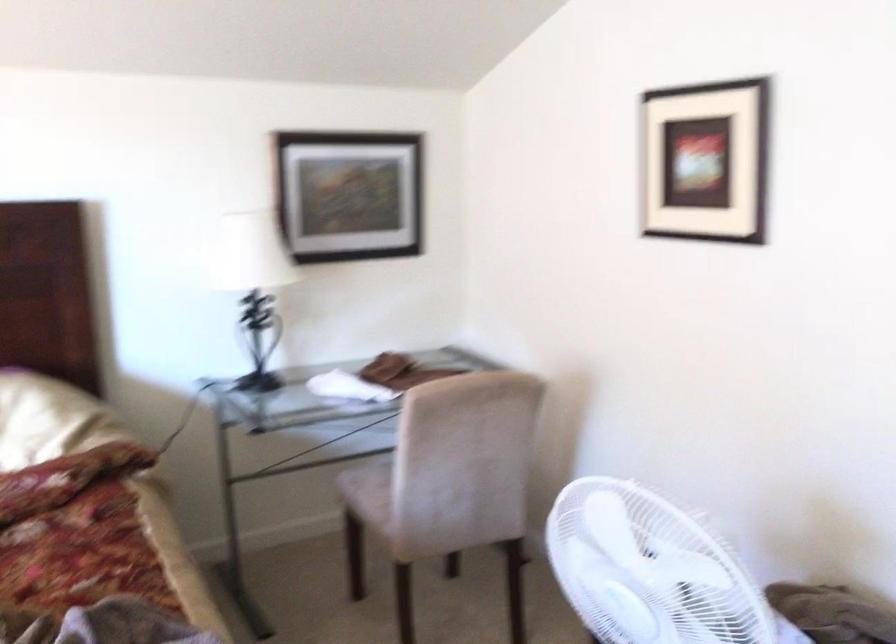
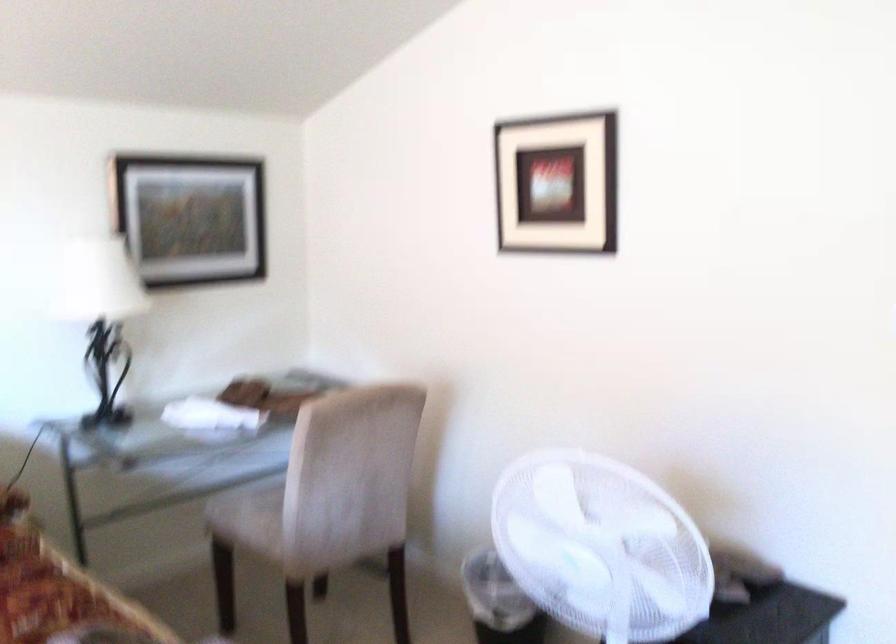
Question: The images are taken continuously from a first-person perspective. In which direction are you moving?

Choices:
 (A) Left
 (B) Right
 (C) Forward
 (D) Backward

Answer: (A)